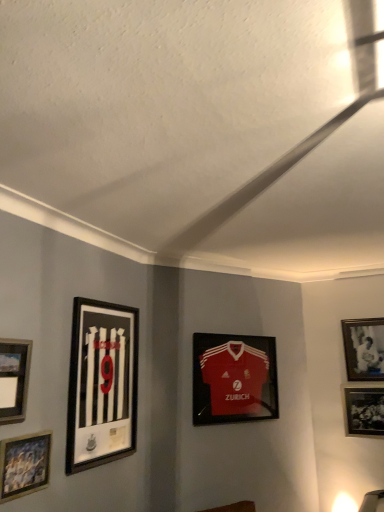
Question: Is black matte picture frame at left, positioned as the 3th picture frame in left-to-right order, at the left side of wooden picture frame at lower left, acting as the fifth picture frame starting from the right?

Choices:
 (A) no
 (B) yes

Answer: (A)

Question: Does black matte picture frame at left, positioned as the 3th picture frame in left-to-right order, appear on the right side of wooden picture frame at lower left, acting as the fifth picture frame starting from the right?

Choices:
 (A) yes
 (B) no

Answer: (A)

Question: Is black matte picture frame at left, the 4th picture frame in the right-to-left sequence, surrounding wooden picture frame at lower left, which is the second picture frame in left-to-right order?

Choices:
 (A) yes
 (B) no

Answer: (B)

Question: Can you confirm if black matte picture frame at left, positioned as the 3th picture frame in left-to-right order, is bigger than wooden picture frame at lower left, which is the second picture frame in left-to-right order?

Choices:
 (A) yes
 (B) no

Answer: (A)

Question: Can we say black matte picture frame at left, the 4th picture frame in the right-to-left sequence, lies outside wooden picture frame at lower left, acting as the fifth picture frame starting from the right?

Choices:
 (A) no
 (B) yes

Answer: (B)

Question: From a real-world perspective, is matte silver picture frame at lower left, the sixth picture frame when ordered from right to left, positioned above or below black matte photo frame at lower right, which ranks as the 5th picture frame in left-to-right order?

Choices:
 (A) below
 (B) above

Answer: (B)

Question: Considering their positions, is matte silver picture frame at lower left, the first picture frame when ordered from left to right, located in front of or behind black matte photo frame at lower right, which ranks as the 5th picture frame in left-to-right order?

Choices:
 (A) behind
 (B) front

Answer: (B)

Question: In terms of height, does matte silver picture frame at lower left, the first picture frame when ordered from left to right, look taller or shorter compared to black matte photo frame at lower right, which ranks as the 5th picture frame in left-to-right order?

Choices:
 (A) short
 (B) tall

Answer: (A)

Question: Would you say matte silver picture frame at lower left, the sixth picture frame when ordered from right to left, is to the left or to the right of black matte photo frame at lower right, placed as the second picture frame when sorted from right to left, in the picture?

Choices:
 (A) left
 (B) right

Answer: (A)

Question: Is point (380, 321) positioned closer to the camera than point (1, 340)?

Choices:
 (A) closer
 (B) farther

Answer: (B)

Question: From the image's perspective, is white matte picture frame at upper right, which is the 1th picture frame from right to left, above or below matte silver picture frame at lower left, the sixth picture frame when ordered from right to left?

Choices:
 (A) above
 (B) below

Answer: (B)

Question: In terms of width, does white matte picture frame at upper right, arranged as the 6th picture frame when viewed from the left, look wider or thinner when compared to matte silver picture frame at lower left, the first picture frame when ordered from left to right?

Choices:
 (A) wide
 (B) thin

Answer: (B)

Question: Looking at the image, does white matte picture frame at upper right, which is the 1th picture frame from right to left, seem bigger or smaller compared to matte silver picture frame at lower left, the first picture frame when ordered from left to right?

Choices:
 (A) small
 (B) big

Answer: (B)

Question: From the image's perspective, is black matte picture frame at left, the 4th picture frame in the right-to-left sequence, above or below white matte picture frame at upper right, arranged as the 6th picture frame when viewed from the left?

Choices:
 (A) above
 (B) below

Answer: (A)

Question: Is black matte picture frame at left, the 4th picture frame in the right-to-left sequence, inside the boundaries of white matte picture frame at upper right, which is the 1th picture frame from right to left, or outside?

Choices:
 (A) inside
 (B) outside

Answer: (B)